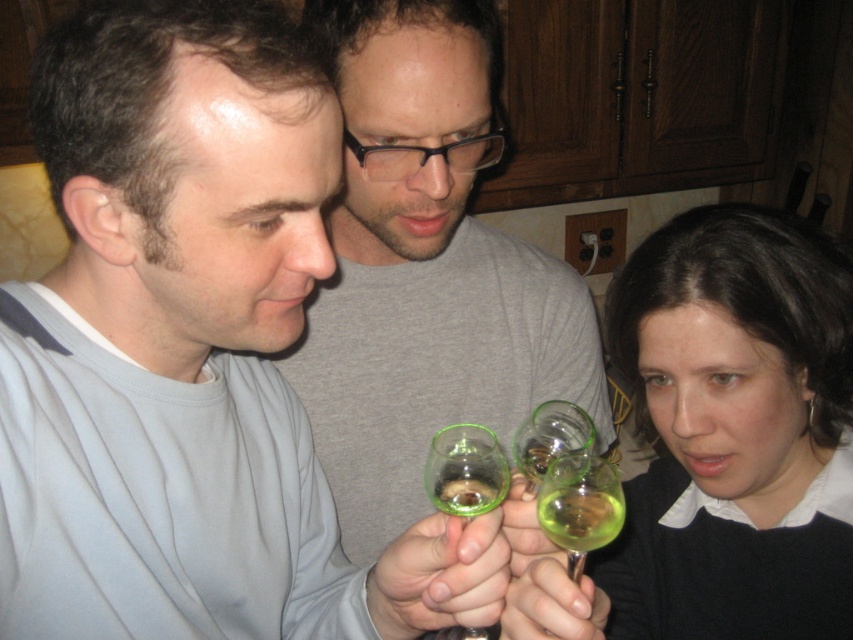
You are a guest at a wine tasting event and see two glasses on the table. The translucent green glass at lower center and the transparent glass at center. Which glass holds less wine?

The translucent green glass at lower center has a smaller size compared to transparent glass at center, so it holds less wine.

You are a wine taster standing 24 inches away from a table where there is a translucent green glass at lower center. Can you reach it without moving your feet?

Result: The translucent green glass at lower center is 20.66 inches from viewer, so yes, you can reach it without moving your feet since it is within your 24 inches reach distance.